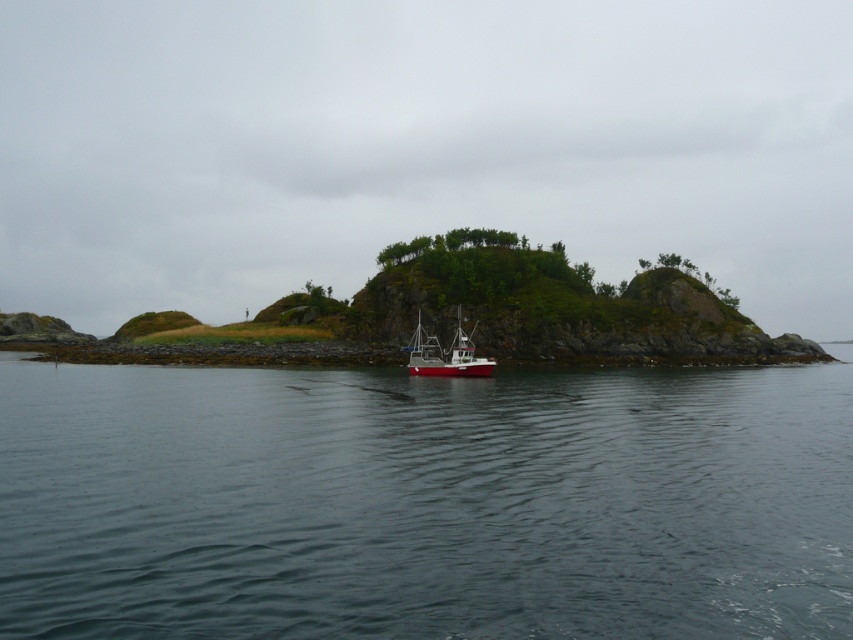
You are a marine biologist studying the coastal ecosystem. You notice the clear water at center and the red matte boat at center. Which object is taller in the scene?

The red matte boat at center is taller than the clear water at center.

Based on the photo, you are a photographer planning to capture the entire scene of the clear water at center and the red matte boat at center in one shot. Considering their widths, which object will require you to adjust your camera angle more to ensure both are fully visible?

The clear water at center has a greater width than the red matte boat at center, so you will need to adjust your camera angle more to accommodate the wider clear water at center.

You are a sailor navigating a small red matte boat at center near a serene island. You notice clear water at center below your boat. What does this indicate about the depth of the water beneath your boat?

The clear water at center below the red matte boat at center suggests that the water is shallow enough for visibility, indicating it might be a safe area to anchor or explore.